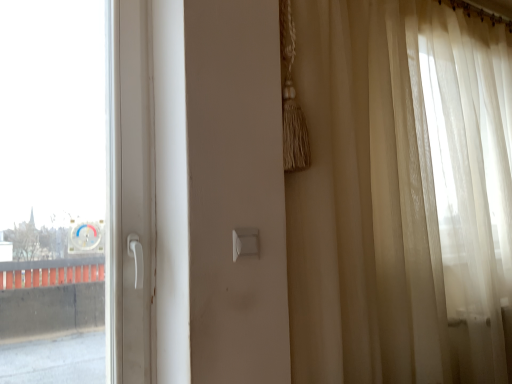
Question: From the image's perspective, is sheer beige curtain at right located above or below white plastic light switch at center?

Choices:
 (A) below
 (B) above

Answer: (B)

Question: Based on their sizes in the image, would you say sheer beige curtain at right is bigger or smaller than white plastic light switch at center?

Choices:
 (A) big
 (B) small

Answer: (A)

Question: Visually, is sheer beige curtain at right positioned to the left or to the right of white plastic light switch at center?

Choices:
 (A) left
 (B) right

Answer: (B)

Question: Considering the positions of white plastic light switch at center and sheer beige curtain at right in the image, is white plastic light switch at center taller or shorter than sheer beige curtain at right?

Choices:
 (A) tall
 (B) short

Answer: (B)

Question: Considering the relative positions of white plastic light switch at center and sheer beige curtain at right in the image provided, is white plastic light switch at center to the left or to the right of sheer beige curtain at right?

Choices:
 (A) left
 (B) right

Answer: (A)

Question: In terms of size, does white plastic light switch at center appear bigger or smaller than sheer beige curtain at right?

Choices:
 (A) big
 (B) small

Answer: (B)

Question: From a real-world perspective, is white plastic light switch at center positioned above or below sheer beige curtain at right?

Choices:
 (A) above
 (B) below

Answer: (B)